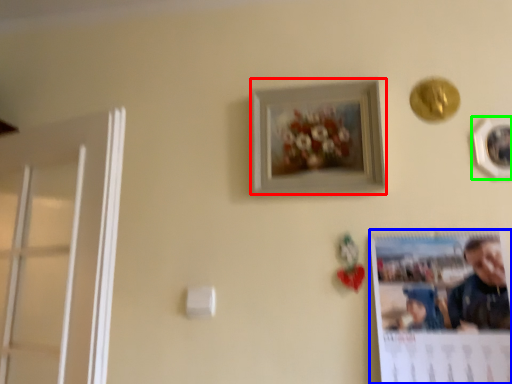
Question: Considering the real-world distances, which object is farthest from picture frame (highlighted by a red box)? poster page (highlighted by a blue box) or picture frame (highlighted by a green box)?

Choices:
 (A) poster page
 (B) picture frame

Answer: (B)